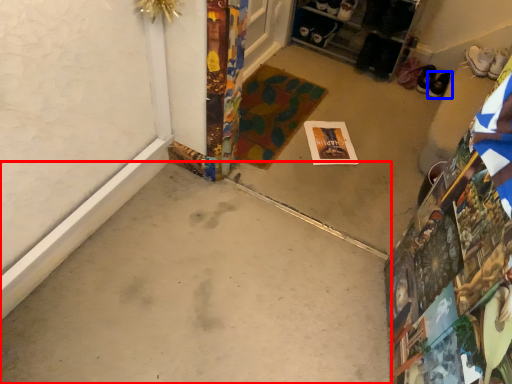
Question: Which point is further to the camera, concrete (highlighted by a red box) or footwear (highlighted by a blue box)?

Choices:
 (A) concrete
 (B) footwear

Answer: (B)